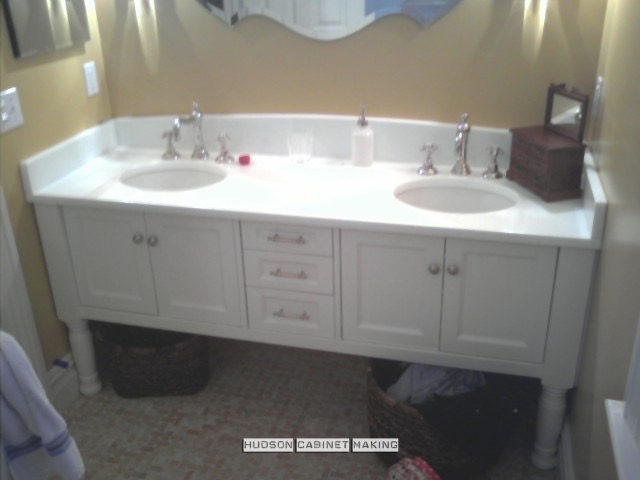
I want to click on cupboard, so click(x=392, y=278).